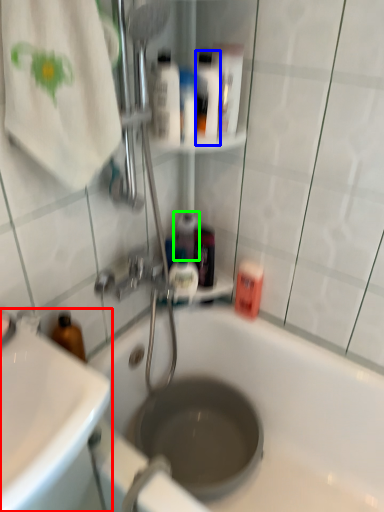
Question: Which object is the closest to the sink (highlighted by a red box)? Choose among these: mouthwash (highlighted by a blue box) or mouthwash (highlighted by a green box).

Choices:
 (A) mouthwash
 (B) mouthwash

Answer: (B)